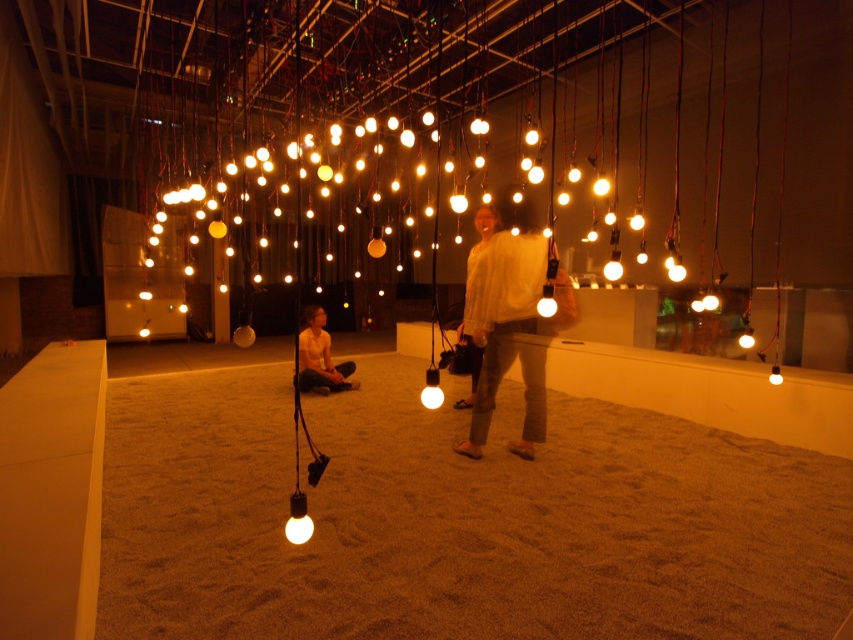
Between point (311, 337) and point (467, 337), which one is positioned in front?

Point (467, 337) is more forward.

Between point (305, 356) and point (485, 220), which one is positioned behind?

The point (305, 356) is behind.

Is point (337, 371) in front of point (469, 268)?

No, it is not.

At what (x,y) coordinates should I click in order to perform the action: click on matte white shirt at center. Please return your answer as a coordinate pair (x, y). Looking at the image, I should click on (318, 356).

Is brown textured sand at center shorter than white matte light bulb at center?

Correct, brown textured sand at center is not as tall as white matte light bulb at center.

Looking at this image, between brown textured sand at center and white matte light bulb at center, which one is positioned higher?

white matte light bulb at center is above.

Is point (802, 518) closer to viewer compared to point (431, 403)?

No.

Find the location of a particular element. This screenshot has width=853, height=640. brown textured sand at center is located at coordinates (456, 520).

Does brown textured sand at center lie in front of white fuzzy sweater at center?

Yes, it is in front of white fuzzy sweater at center.

Is point (363, 388) closer to camera compared to point (469, 291)?

No, it is not.

Identify the location of brown textured sand at center. (456, 520).